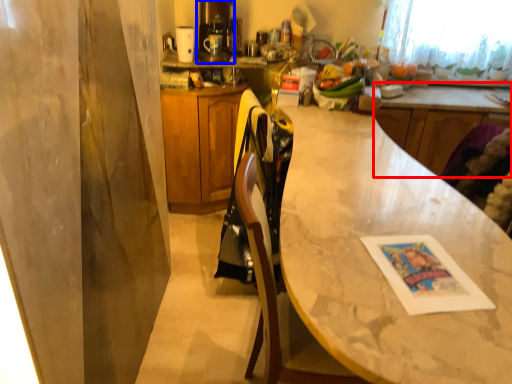
Question: Among these objects, which one is nearest to the camera, counter (highlighted by a red box) or coffee machine (highlighted by a blue box)?

Choices:
 (A) counter
 (B) coffee machine

Answer: (B)